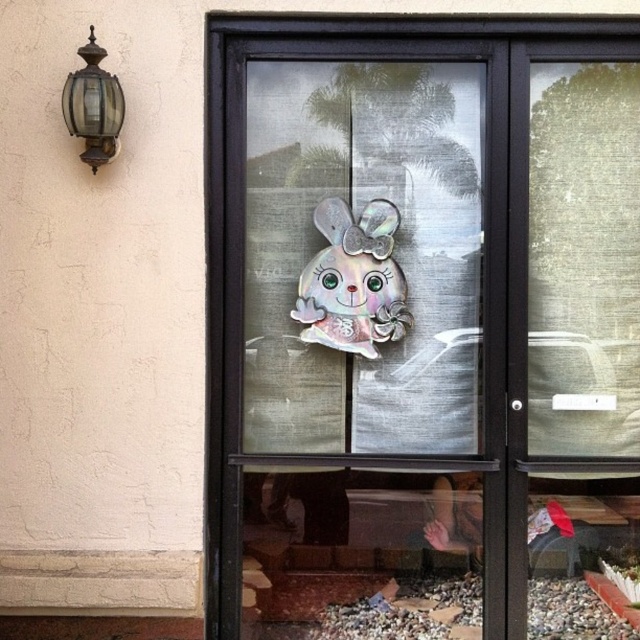
You are a delivery person trying to locate the entrance to the building. You see the holographic sticker at center and the bronze glass lantern at upper left. Which object is closer to the main entrance?

The holographic sticker at center is closer to the main entrance because it is larger in size than the bronze glass lantern at upper left, indicating it is positioned nearer to the viewer.

You are a delivery person trying to place a holographic sticker at center and a holographic bunny at center on the frosted glass door. The door has limited space. Which holographic design should you choose if you want the taller one?

The holographic sticker at center has a greater height compared to the holographic bunny at center, so you should choose the holographic sticker at center if you want the taller one.